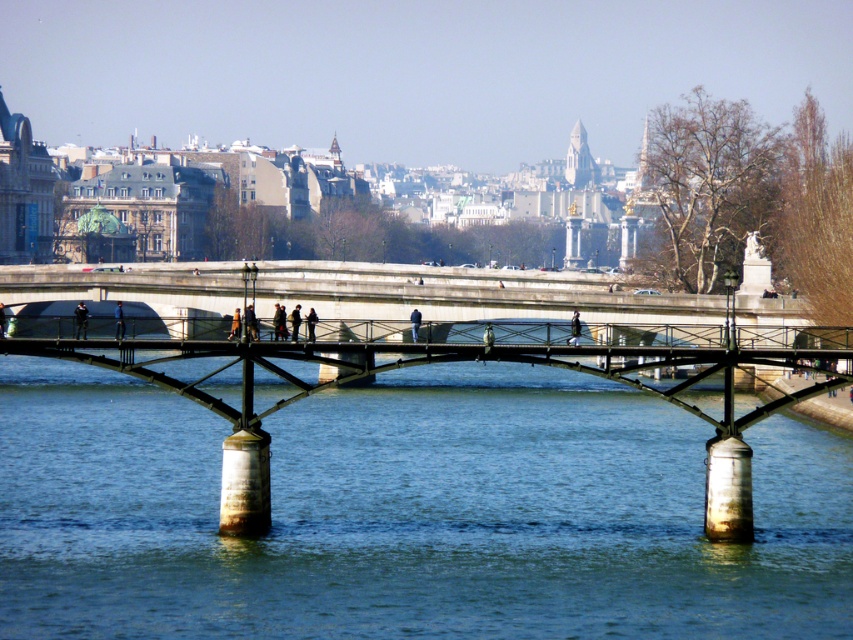
Who is more distant from viewer, (80, 307) or (115, 307)?

Positioned behind is point (115, 307).

Is dark blue fabric jacket at center positioned before blue fabric pedestrian at center?

Yes, dark blue fabric jacket at center is in front of blue fabric pedestrian at center.

Identify the location of dark blue fabric jacket at center. (80, 321).

Does point (248, 336) come behind point (115, 308)?

Yes.

Which of these two, dark blue jeans at center or blue fabric pedestrian at center, stands taller?

Standing taller between the two is blue fabric pedestrian at center.

Between point (251, 307) and point (119, 316), which one is positioned in front?

Point (119, 316)

Where is `dark blue jeans at center`? This screenshot has width=853, height=640. dark blue jeans at center is located at coordinates (250, 323).

Is dark blue jeans at center positioned behind dark blue fabric jacket at center?

Yes, dark blue jeans at center is further from the viewer.

The height and width of the screenshot is (640, 853). Identify the location of dark blue jeans at center. (250, 323).